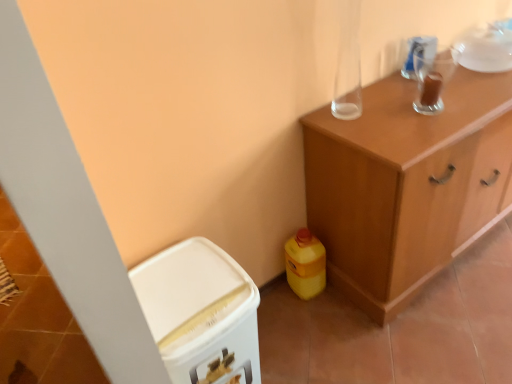
The image size is (512, 384). I want to click on vacant position to the left of transparent glass cup at upper right, so click(385, 110).